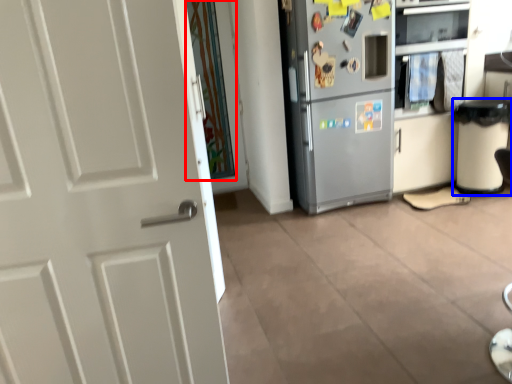
Question: Among these objects, which one is farthest to the camera, glass door (highlighted by a red box) or trash bin/can (highlighted by a blue box)?

Choices:
 (A) glass door
 (B) trash bin/can

Answer: (A)